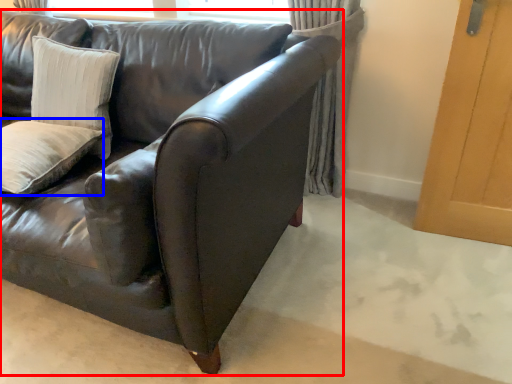
Question: Which point is closer to the camera, studio couch (highlighted by a red box) or pillow (highlighted by a blue box)?

Choices:
 (A) studio couch
 (B) pillow

Answer: (A)